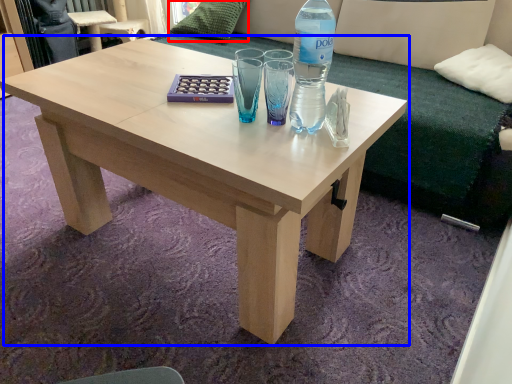
Question: Which of the following is the farthest to the observer, pillow (highlighted by a red box) or coffee table (highlighted by a blue box)?

Choices:
 (A) pillow
 (B) coffee table

Answer: (A)